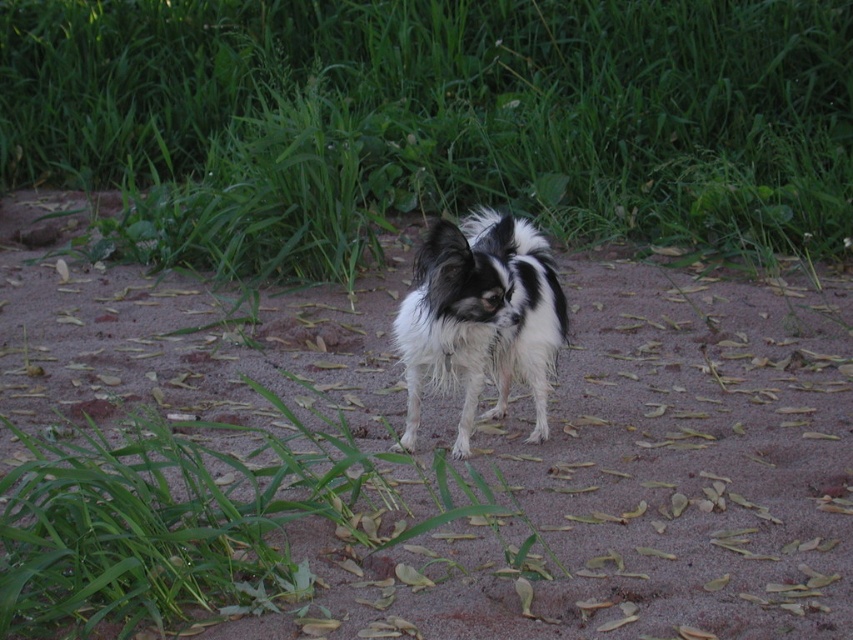
What do you see at coordinates (643, 481) in the screenshot?
I see `brown sandy ground at center` at bounding box center [643, 481].

Can you confirm if brown sandy ground at center is bigger than fluffy black-and-white dog at center?

Correct, brown sandy ground at center is larger in size than fluffy black-and-white dog at center.

You are a GUI agent. You are given a task and a screenshot of the screen. Output one action in this format:
    pyautogui.click(x=<x>, y=<y>)
    Task: Click on the brown sandy ground at center
    
    Given the screenshot: What is the action you would take?
    pyautogui.click(x=643, y=481)

Between point (15, 22) and point (480, 348), which one is positioned behind?

The point (15, 22) is more distant.

Who is higher up, green leafy grass at center or fluffy black-and-white dog at center?

green leafy grass at center is higher up.

Is point (21, 72) behind point (491, 241)?

Yes, it is.

What are the coordinates of `green leafy grass at center` in the screenshot? It's located at (432, 122).

Is green leafy grass at center below brown sandy ground at center?

No.

Who is positioned more to the left, green leafy grass at center or brown sandy ground at center?

green leafy grass at center

Does point (183, 128) come in front of point (56, 300)?

No, (183, 128) is further to viewer.

The image size is (853, 640). In order to click on green leafy grass at center in this screenshot , I will do `click(432, 122)`.